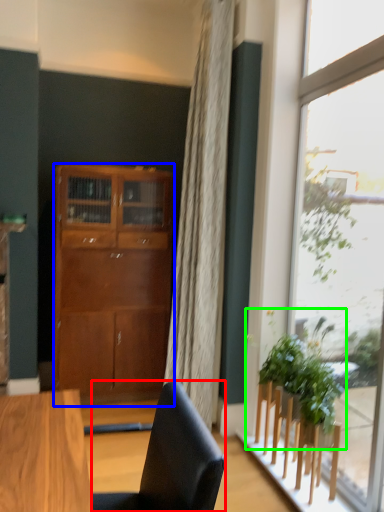
Question: Estimate the real-world distances between objects in this image. Which object is closer to chair (highlighted by a red box), cabinetry (highlighted by a blue box) or houseplant (highlighted by a green box)?

Choices:
 (A) cabinetry
 (B) houseplant

Answer: (B)